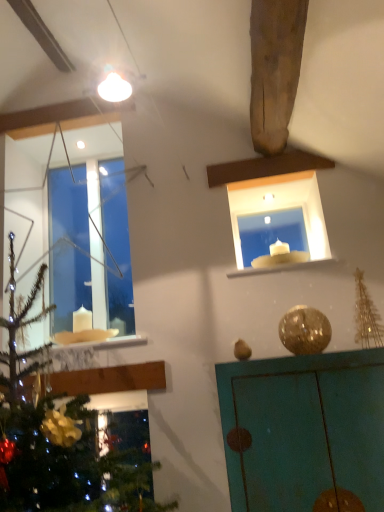
Question: From a real-world perspective, is white marble window sill at upper center on white glass candle at upper center?

Choices:
 (A) no
 (B) yes

Answer: (A)

Question: Considering the relative sizes of white marble window sill at upper center and white glass candle at upper center in the image provided, is white marble window sill at upper center shorter than white glass candle at upper center?

Choices:
 (A) no
 (B) yes

Answer: (B)

Question: Does white marble window sill at upper center appear on the left side of white glass candle at upper center?

Choices:
 (A) no
 (B) yes

Answer: (B)

Question: Can you confirm if white marble window sill at upper center is thinner than white glass candle at upper center?

Choices:
 (A) no
 (B) yes

Answer: (A)

Question: From the image's perspective, is white marble window sill at upper center located beneath white glass candle at upper center?

Choices:
 (A) yes
 (B) no

Answer: (A)

Question: Is white glass candle at upper center at the back of white marble window sill at upper center?

Choices:
 (A) no
 (B) yes

Answer: (A)

Question: Does transparent glass window at upper left have a greater width compared to white glass candle at upper center?

Choices:
 (A) yes
 (B) no

Answer: (B)

Question: From a real-world perspective, is transparent glass window at upper left physically below white glass candle at upper center?

Choices:
 (A) yes
 (B) no

Answer: (B)

Question: Does transparent glass window at upper left have a larger size compared to white glass candle at upper center?

Choices:
 (A) yes
 (B) no

Answer: (A)

Question: Does transparent glass window at upper left have a lesser width compared to white glass candle at upper center?

Choices:
 (A) yes
 (B) no

Answer: (A)

Question: From the image's perspective, is transparent glass window at upper left below white glass candle at upper center?

Choices:
 (A) yes
 (B) no

Answer: (B)

Question: From a real-world perspective, is transparent glass window at upper left located higher than white glass candle at upper center?

Choices:
 (A) no
 (B) yes

Answer: (B)

Question: From the image's perspective, would you say white marble window sill at upper center is positioned over teal painted cabinet at upper right?

Choices:
 (A) yes
 (B) no

Answer: (A)